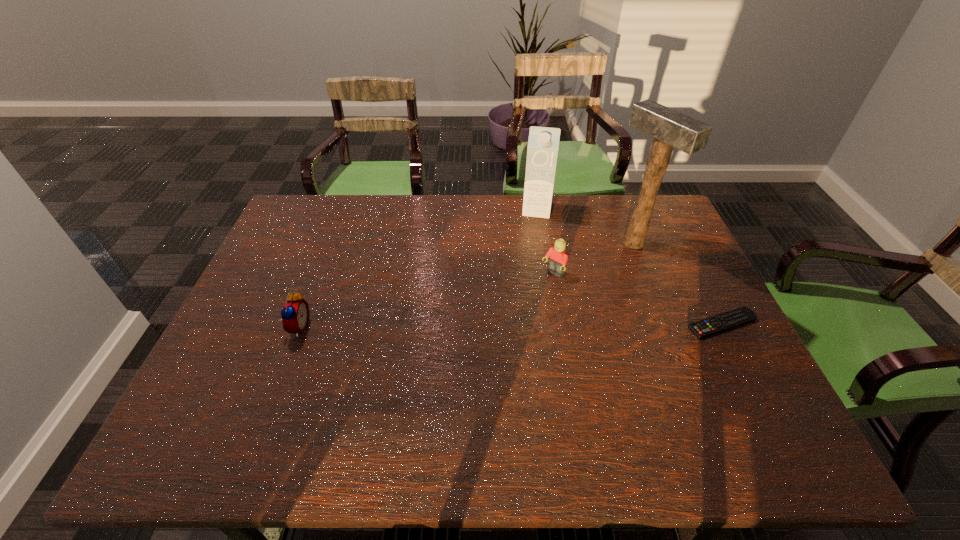
Choose which object is the second nearest neighbor to the shortest object. Please provide its 2D coordinates. Your answer should be formatted as a tuple, i.e. [(x, y)], where the tuple contains the x and y coordinates of a point satisfying the conditions above.

[(558, 260)]

This screenshot has height=540, width=960. In order to click on vacant space that satisfies the following two spatial constraints: 1. on the front side of the fourth shortest object; 2. on the left side of the remote control in this screenshot , I will do `click(555, 324)`.